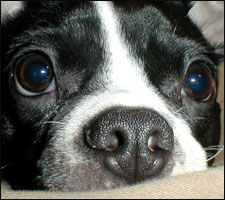
Identify the location of blanket. This screenshot has height=200, width=225. (176, 192).